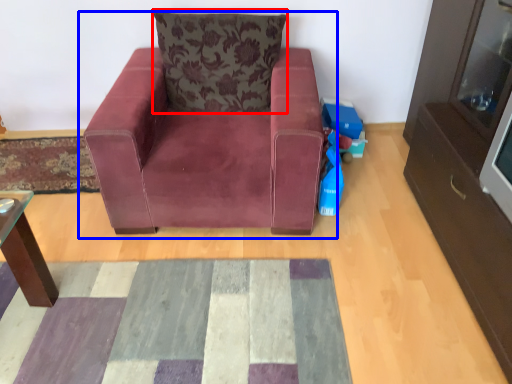
Question: Which of the following is the closest to the observer, pillow (highlighted by a red box) or chair (highlighted by a blue box)?

Choices:
 (A) pillow
 (B) chair

Answer: (B)